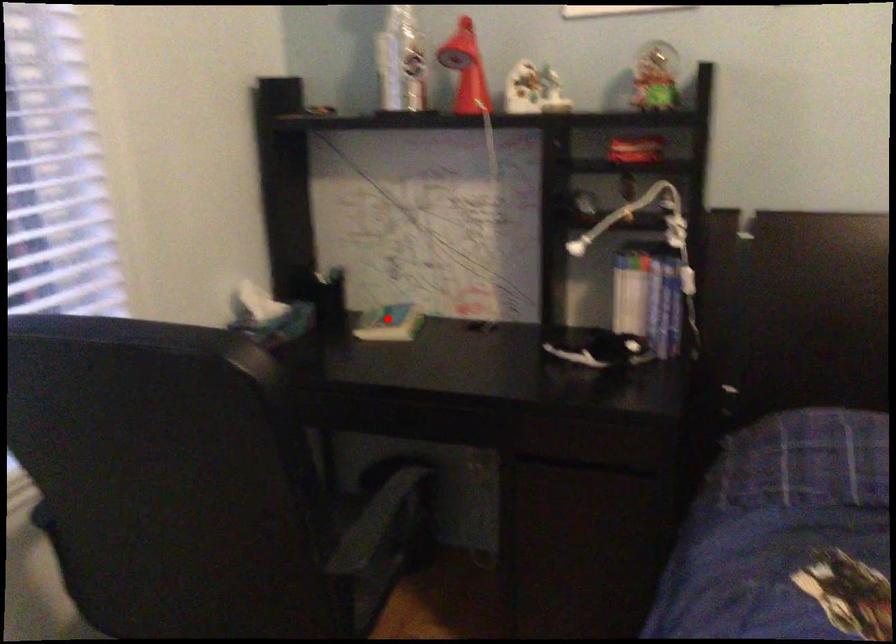
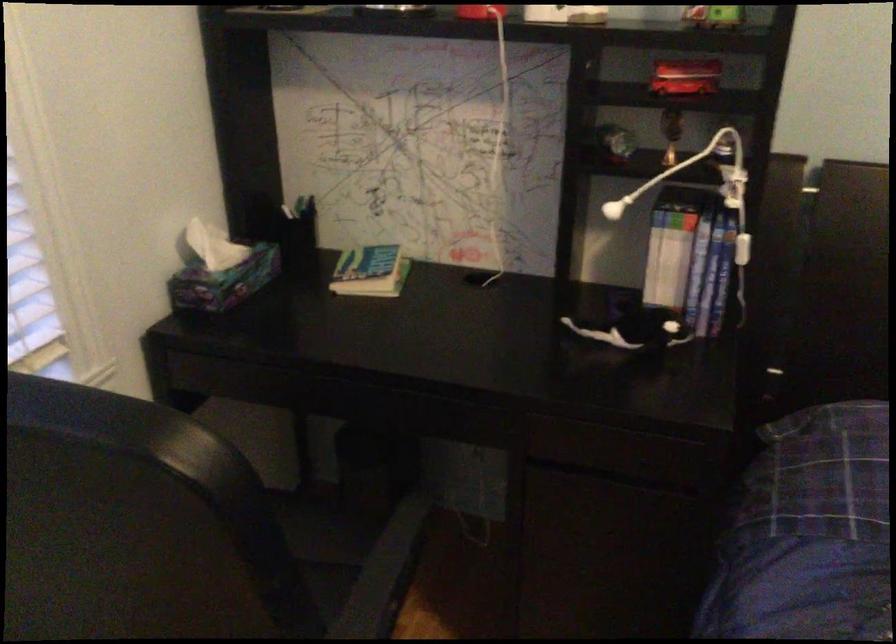
Question: I am providing you with two images of the same scene from different viewpoints. Image1 has a red point marked. In image2, the corresponding 3D location appears at what relative position? Reply with the corresponding letter.

Choices:
 (A) Closer
 (B) Farther

Answer: (A)